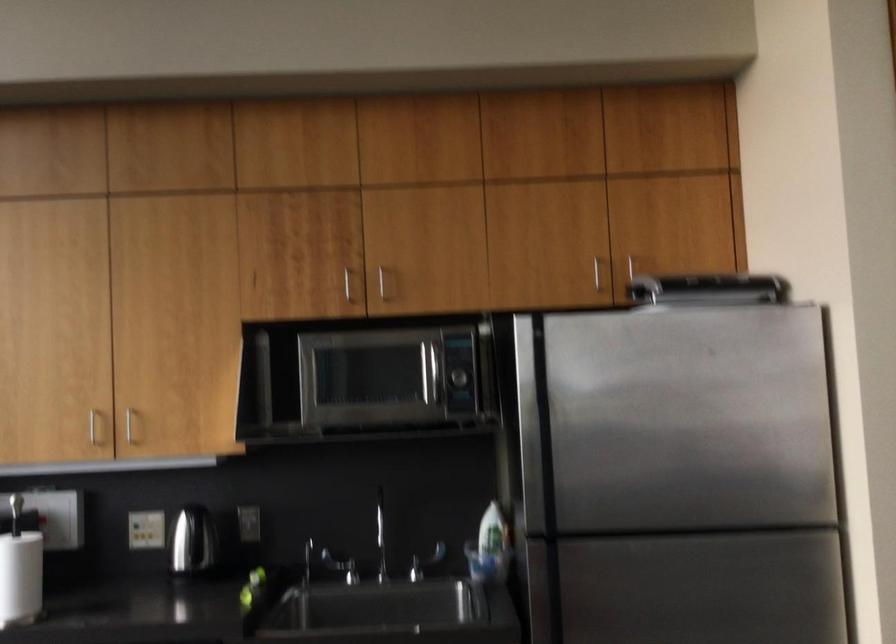
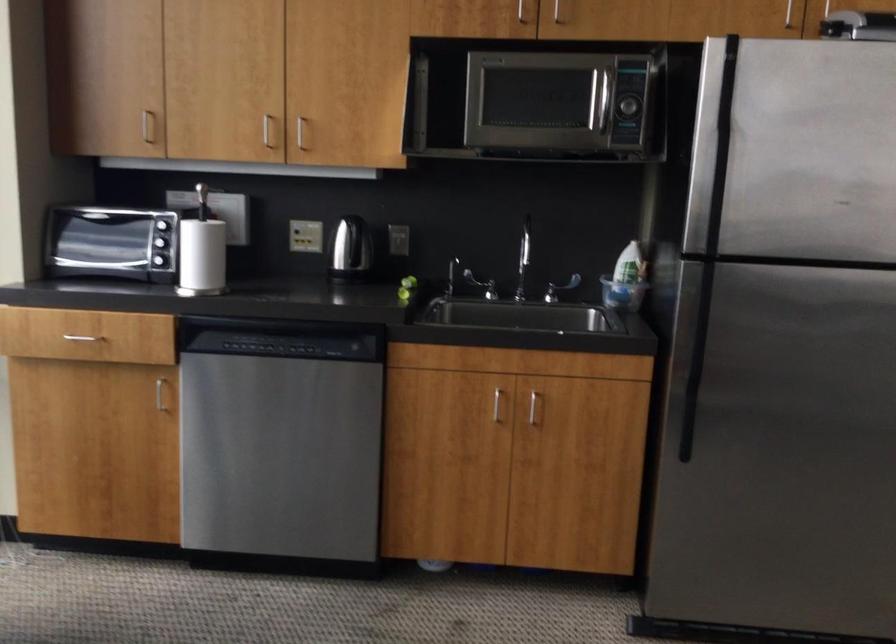
Where in the second image is the point corresponding to point 485,559 from the first image?

(622, 294)